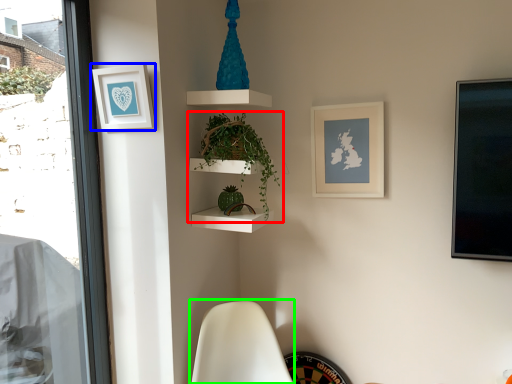
Question: Which is farther away from houseplant (highlighted by a red box)? picture frame (highlighted by a blue box) or swivel chair (highlighted by a green box)?

Choices:
 (A) picture frame
 (B) swivel chair

Answer: (B)